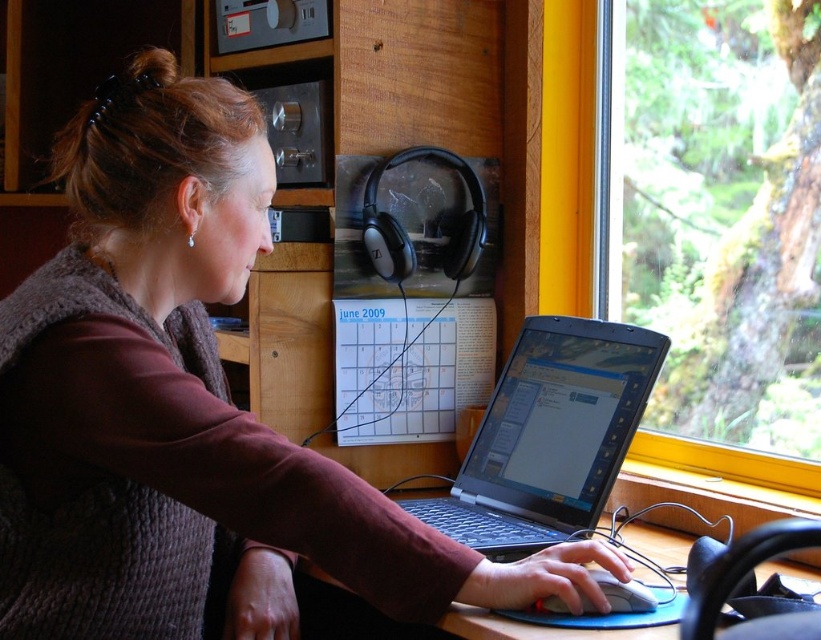
Does matte brown sweater at center appear over black plastic laptop at center?

Yes, matte brown sweater at center is above black plastic laptop at center.

Find the location of `matte brown sweater at center`. matte brown sweater at center is located at coordinates (187, 406).

The width and height of the screenshot is (821, 640). What are the coordinates of `matte brown sweater at center` in the screenshot? It's located at (187, 406).

Between matte brown sweater at center and white plastic mouse at lower center, which one is positioned lower?

Positioned lower is white plastic mouse at lower center.

At what (x,y) coordinates should I click in order to perform the action: click on matte brown sweater at center. Please return your answer as a coordinate pair (x, y). This screenshot has height=640, width=821. Looking at the image, I should click on (187, 406).

How much distance is there between transparent glass window at upper right and white plastic mouse at lower center?

transparent glass window at upper right is 29.36 inches from white plastic mouse at lower center.

Can you confirm if transparent glass window at upper right is positioned above white plastic mouse at lower center?

Correct, transparent glass window at upper right is located above white plastic mouse at lower center.

Locate an element on the screen. The height and width of the screenshot is (640, 821). transparent glass window at upper right is located at coordinates (723, 228).